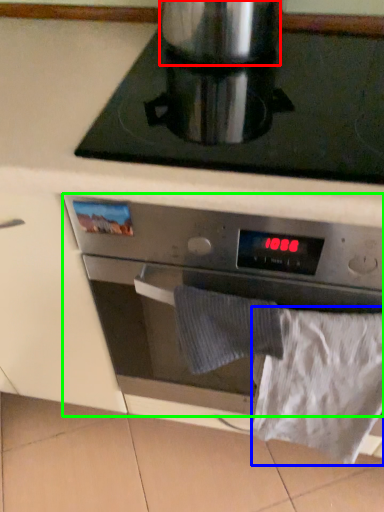
Question: Which is nearer to the appliance (highlighted by a red box)? sheet (highlighted by a blue box) or kitchen appliance (highlighted by a green box).

Choices:
 (A) sheet
 (B) kitchen appliance

Answer: (B)